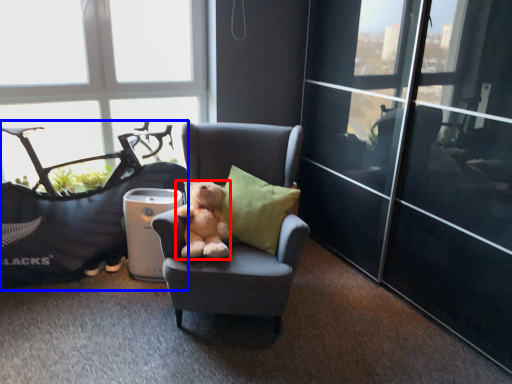
Question: Which object is closer to the camera taking this photo, teddy bear (highlighted by a red box) or bean bag chair (highlighted by a blue box)?

Choices:
 (A) teddy bear
 (B) bean bag chair

Answer: (A)